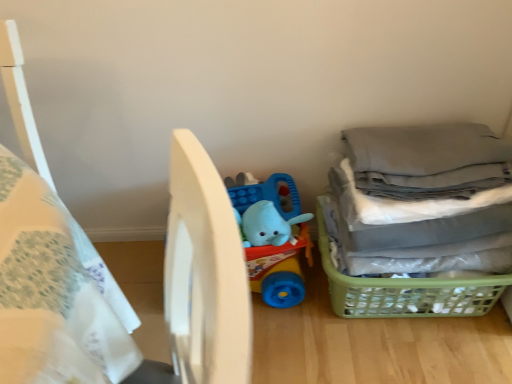
Question: Does gray fabric laundry at right appear on the left side of white matte bed at center?

Choices:
 (A) yes
 (B) no

Answer: (B)

Question: Would you consider gray fabric laundry at right to be distant from white matte bed at center?

Choices:
 (A) no
 (B) yes

Answer: (A)

Question: Considering the relative positions of gray fabric laundry at right and white matte bed at center in the image provided, is gray fabric laundry at right to the right of white matte bed at center from the viewer's perspective?

Choices:
 (A) no
 (B) yes

Answer: (B)

Question: Can you confirm if gray fabric laundry at right is wider than white matte bed at center?

Choices:
 (A) no
 (B) yes

Answer: (A)

Question: Is gray fabric laundry at right surrounding white matte bed at center?

Choices:
 (A) no
 (B) yes

Answer: (A)

Question: Could you tell me if gray fabric laundry at right is turned towards white matte bed at center?

Choices:
 (A) no
 (B) yes

Answer: (A)

Question: Does blue rubber elephant at center lie behind gray fabric laundry at right?

Choices:
 (A) no
 (B) yes

Answer: (B)

Question: Is blue rubber elephant at center in front of gray fabric laundry at right?

Choices:
 (A) yes
 (B) no

Answer: (B)

Question: From a real-world perspective, is blue rubber elephant at center located beneath gray fabric laundry at right?

Choices:
 (A) no
 (B) yes

Answer: (B)

Question: Is gray fabric laundry at right surrounded by blue rubber elephant at center?

Choices:
 (A) no
 (B) yes

Answer: (A)

Question: Does blue rubber elephant at center have a greater height compared to gray fabric laundry at right?

Choices:
 (A) yes
 (B) no

Answer: (B)

Question: Is blue rubber elephant at center to the right of gray fabric laundry at right from the viewer's perspective?

Choices:
 (A) yes
 (B) no

Answer: (B)

Question: Is white matte bed at center looking in the opposite direction of gray fabric laundry at right?

Choices:
 (A) no
 (B) yes

Answer: (A)